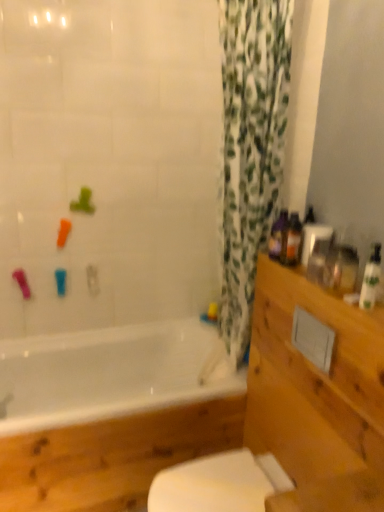
Question: Looking at the image, does green leafy fabric at center seem bigger or smaller compared to white glossy bathtub at lower left?

Choices:
 (A) big
 (B) small

Answer: (B)

Question: Visually, is green leafy fabric at center positioned to the left or to the right of white glossy bathtub at lower left?

Choices:
 (A) right
 (B) left

Answer: (A)

Question: Which is farther from the white glossy toilet at lower center?

Choices:
 (A) white glossy bottle at right, the first toiletry viewed from the front
 (B) white glossy bathtub at lower left
 (C) wooden drawer at right
 (D) translucent plastic bottles at upper right, the 2th toiletry when ordered from back to front
 (E) green leafy fabric at center

Answer: (A)

Question: Which is nearer to the green leafy fabric at center?

Choices:
 (A) translucent plastic bottles at upper right, placed as the second toiletry when sorted from left to right
 (B) white glossy bottle at right, the 3th toiletry viewed from the back
 (C) white glossy toilet at lower center
 (D) white glossy bathtub at lower left
 (E) wooden drawer at right

Answer: (A)